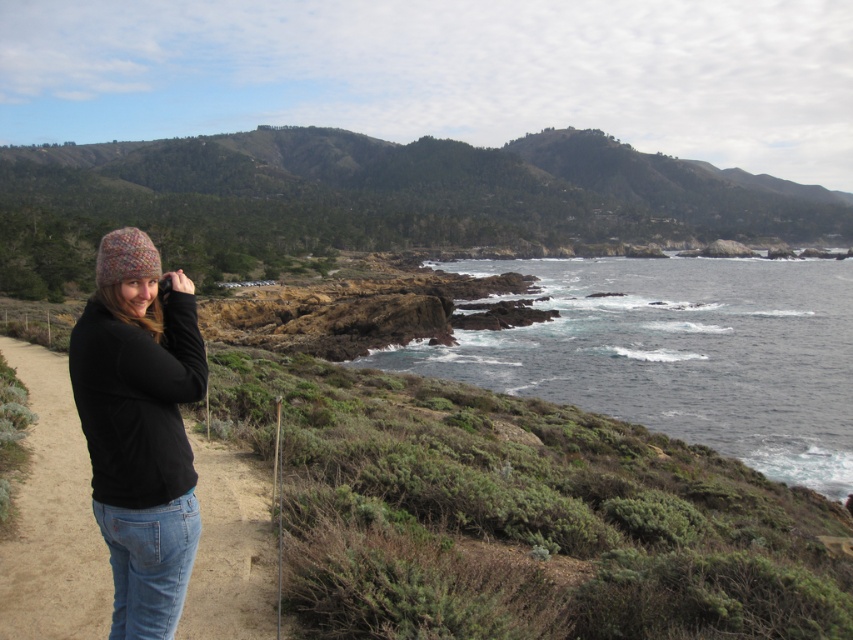
Question: Which of these objects is positioned farthest from the green grassy hillside at upper center?

Choices:
 (A) knitted wool hat at left
 (B) black fabric path at lower left

Answer: (A)

Question: Can you confirm if green grassy hillside at upper center is thinner than knitted woolen hat at left?

Choices:
 (A) yes
 (B) no

Answer: (B)

Question: Which is nearer to the knitted woolen hat at left?

Choices:
 (A) black fabric path at lower left
 (B) dark blue water at center

Answer: (A)

Question: Among these points, which one is nearest to the camera?

Choices:
 (A) (808, 374)
 (B) (113, 252)
 (C) (408, 180)

Answer: (B)

Question: Is green grassy hillside at upper center below dark blue water at center?

Choices:
 (A) no
 (B) yes

Answer: (A)

Question: Considering the relative positions of knitted wool hat at left and black fabric path at lower left in the image provided, where is knitted wool hat at left located with respect to black fabric path at lower left?

Choices:
 (A) above
 (B) below

Answer: (A)